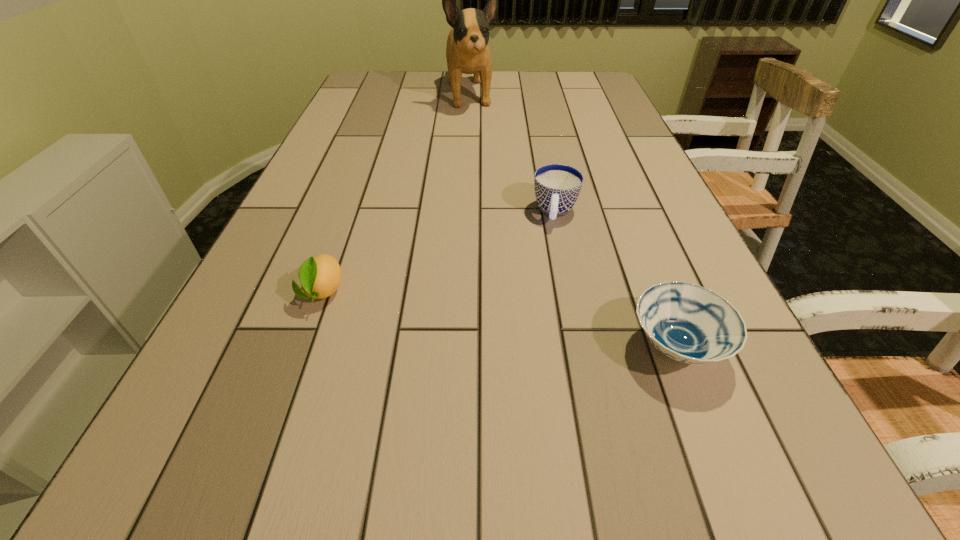
In order to click on lemon in this screenshot , I will do (320, 276).

In order to click on soup bowl in this screenshot , I will do `click(686, 322)`.

The width and height of the screenshot is (960, 540). I want to click on the second object from left to right, so click(x=467, y=51).

At what (x,y) coordinates should I click in order to perform the action: click on puppy. Please return your answer as a coordinate pair (x, y). This screenshot has height=540, width=960. Looking at the image, I should click on (467, 51).

The height and width of the screenshot is (540, 960). I want to click on the third object from left to right, so click(x=557, y=187).

Where is `the third nearest object`? This screenshot has width=960, height=540. the third nearest object is located at coordinates (557, 187).

Locate an element on the screen. free spot located 0.060m with leaves positioned above the lemon is located at coordinates (304, 342).

Find the location of a particular element. The image size is (960, 540). vacant space situated 0.060m on the front of the rightmost object is located at coordinates (708, 426).

At what (x,y) coordinates should I click in order to perform the action: click on free region located 0.130m at the face of the farthest object. Please return your answer as a coordinate pair (x, y). The width and height of the screenshot is (960, 540). Looking at the image, I should click on (479, 136).

This screenshot has height=540, width=960. Find the location of `blank area located 0.310m at the face of the farthest object`. blank area located 0.310m at the face of the farthest object is located at coordinates (488, 168).